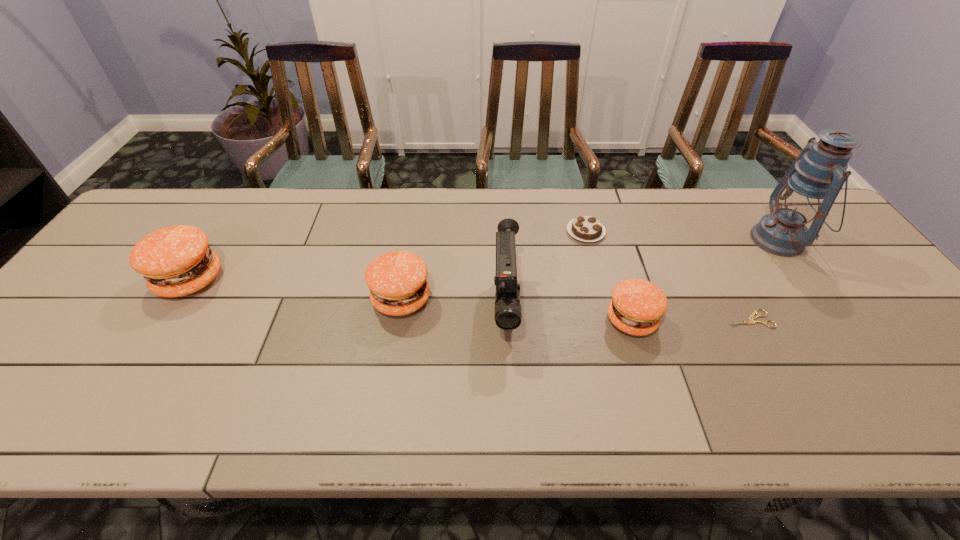
Identify the location of the leftmost object. This screenshot has height=540, width=960. (176, 261).

The height and width of the screenshot is (540, 960). Identify the location of the sixth object from right to left. (397, 280).

Locate an element on the screen. This screenshot has height=540, width=960. the fourth shortest object is located at coordinates (397, 280).

This screenshot has height=540, width=960. I want to click on the shortest patty, so 637,305.

You are a GUI agent. You are given a task and a screenshot of the screen. Output one action in this format:
    pyautogui.click(x=<x>, y=<y>)
    Task: Click on the fifth tallest object
    The width and height of the screenshot is (960, 540).
    Given the screenshot: What is the action you would take?
    pyautogui.click(x=637, y=305)

Find the location of a particular element. The width and height of the screenshot is (960, 540). the sixth tallest object is located at coordinates (584, 228).

I want to click on lantern, so click(808, 190).

What are the coordinates of `the rightmost object` in the screenshot? It's located at (808, 190).

Where is `shears`? shears is located at coordinates (751, 321).

You are a GUI agent. You are given a task and a screenshot of the screen. Output one action in this format:
    pyautogui.click(x=<x>, y=<y>)
    Task: Click on the shortest object
    This screenshot has width=960, height=540.
    Given the screenshot: What is the action you would take?
    pyautogui.click(x=751, y=321)